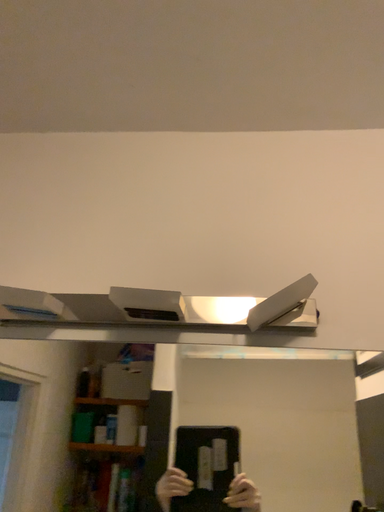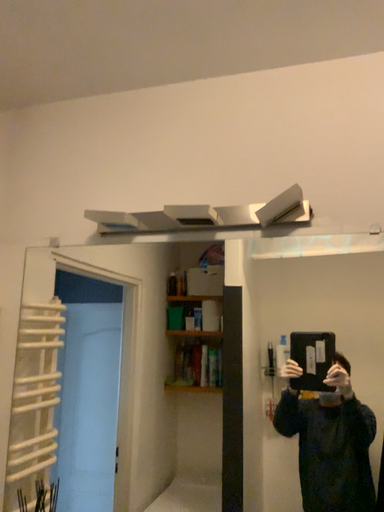
Question: How did the camera likely rotate when shooting the video?

Choices:
 (A) rotated left
 (B) rotated right

Answer: (A)